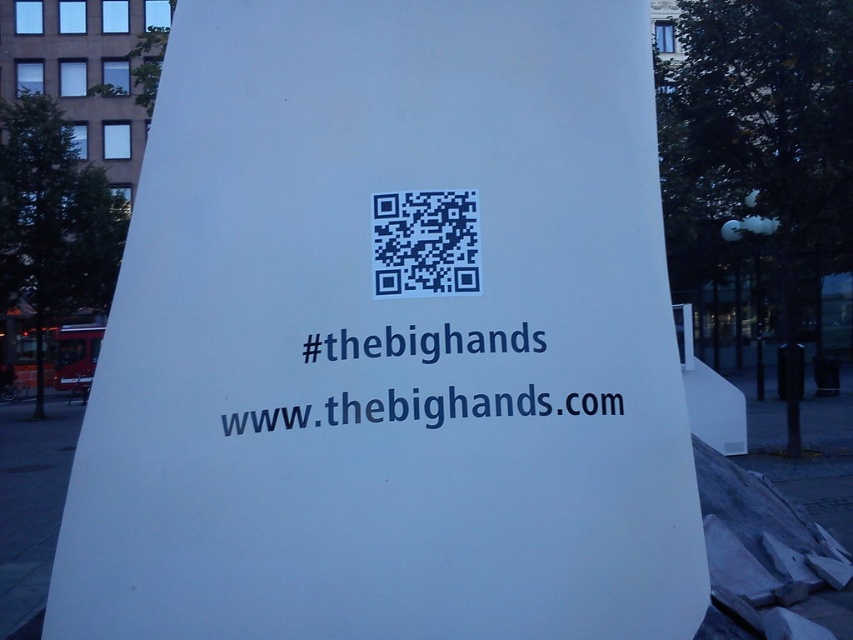
You are an artist planning to paint the large white triangular structure. You need to know which part is wider between the blue text at center and the dark blue qr code at center. Which one is wider?

The blue text at center is wider than the dark blue qr code at center according to the description.

You are an artist planning to paint the large white triangular structure. You notice the blue text at center and the dark blue qr code at center. Which of these two elements has a smaller height?

The blue text at center has a lesser height compared to the dark blue qr code at center, so the blue text at center is smaller in height.